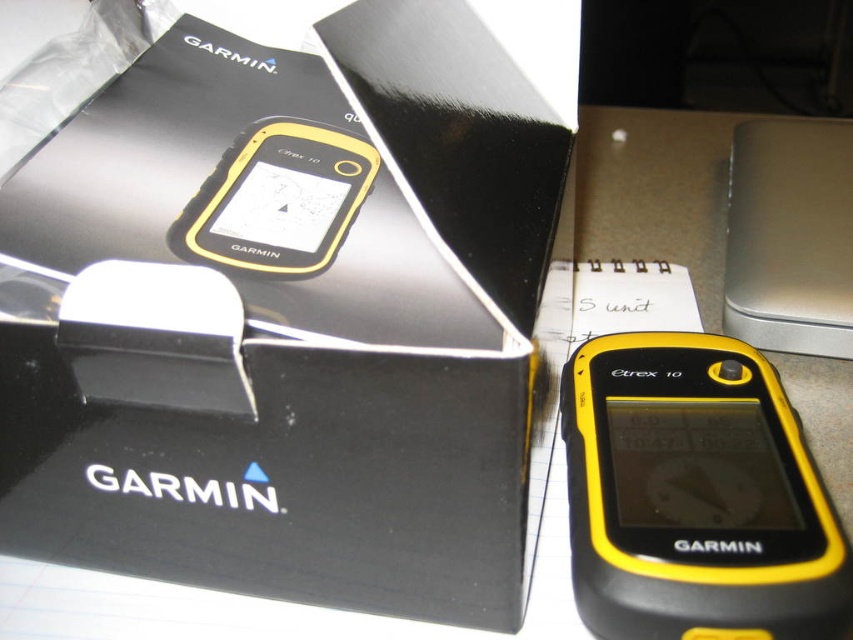
Question: Does black matte box at center have a lesser width compared to yellow matte gps device at center?

Choices:
 (A) no
 (B) yes

Answer: (A)

Question: Does black matte box at center appear on the left side of yellow matte gps device at center?

Choices:
 (A) no
 (B) yes

Answer: (A)

Question: Among these objects, which one is nearest to the camera?

Choices:
 (A) yellow matte gps device at center
 (B) yellow matte/gps device at center
 (C) black matte box at center

Answer: (C)

Question: Which point appears closest to the camera in this image?

Choices:
 (A) (x=119, y=432)
 (B) (x=704, y=396)
 (C) (x=310, y=193)

Answer: (A)

Question: Which of the following is the farthest from the observer?

Choices:
 (A) yellow matte gps device at center
 (B) yellow matte/gps device at center
 (C) black matte box at center

Answer: (A)

Question: Is black matte box at center to the left of yellow matte gps device at center from the viewer's perspective?

Choices:
 (A) no
 (B) yes

Answer: (A)